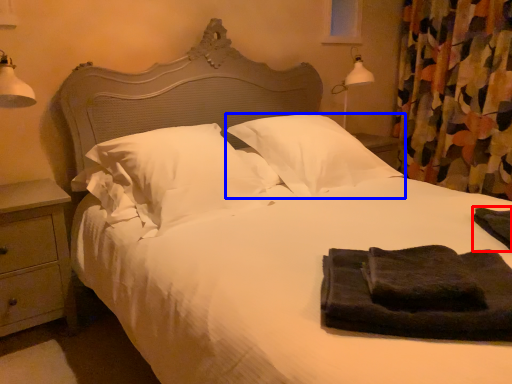
Question: Which of the following is the closest to the observer, material (highlighted by a red box) or pillow (highlighted by a blue box)?

Choices:
 (A) material
 (B) pillow

Answer: (A)